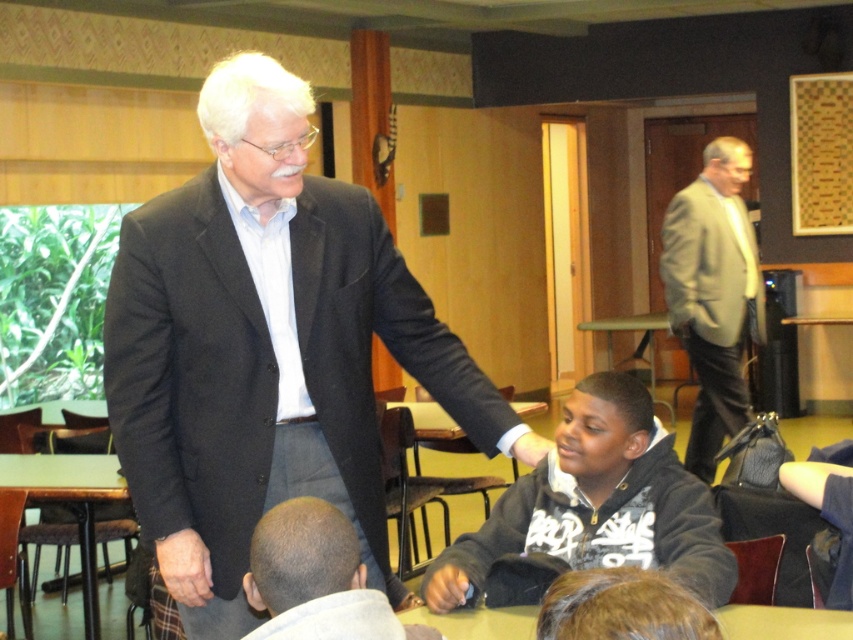
Question: Can you confirm if bald head at lower center is bigger than wooden table at lower left?

Choices:
 (A) yes
 (B) no

Answer: (B)

Question: Estimate the real-world distances between objects in this image. Which object is closer to the black fleece jacket at lower center?

Choices:
 (A) light gray suit at right
 (B) bald head at lower center

Answer: (B)

Question: Does light gray suit at right lie in front of bald head at lower center?

Choices:
 (A) yes
 (B) no

Answer: (B)

Question: Which point is farther to the camera?

Choices:
 (A) (341, 608)
 (B) (102, 496)
 (C) (747, 316)

Answer: (C)

Question: Which object is positioned closest to the wooden table at lower left?

Choices:
 (A) light gray suit at right
 (B) black fleece jacket at lower center
 (C) bald head at lower center

Answer: (B)

Question: Considering the relative positions of dark gray suit at center and bald head at lower center in the image provided, where is dark gray suit at center located with respect to bald head at lower center?

Choices:
 (A) left
 (B) right

Answer: (A)